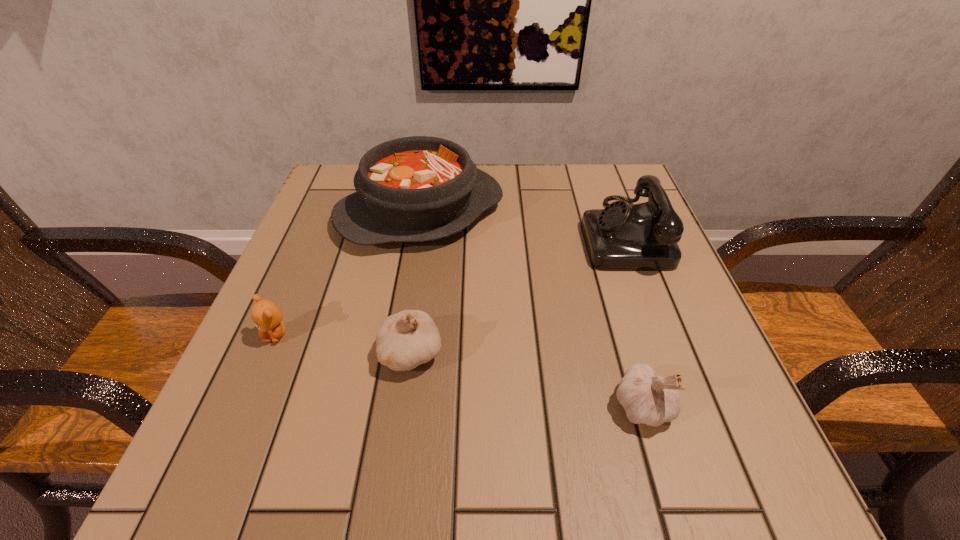
Image resolution: width=960 pixels, height=540 pixels. Find the location of `casserole`. casserole is located at coordinates (412, 189).

Where is `telephone`? The image size is (960, 540). telephone is located at coordinates (641, 237).

Locate an element on the screen. the right garlic is located at coordinates (648, 399).

This screenshot has height=540, width=960. What are the coordinates of `the left garlic` in the screenshot? It's located at (405, 340).

You are a GUI agent. You are given a task and a screenshot of the screen. Output one action in this format:
    pyautogui.click(x=<x>, y=<y>)
    Task: Click on the teddy bear
    
    Given the screenshot: What is the action you would take?
    pyautogui.click(x=266, y=315)

You are a GUI agent. You are given a task and a screenshot of the screen. Output one action in this format:
    pyautogui.click(x=<x>, y=<y>)
    Task: Click on the shortest object
    The width and height of the screenshot is (960, 540).
    Given the screenshot: What is the action you would take?
    pyautogui.click(x=266, y=315)

Locate an element on the screen. Image resolution: width=960 pixels, height=540 pixels. vacant space located on the back of the casserole is located at coordinates (428, 166).

The height and width of the screenshot is (540, 960). What are the coordinates of `vacant space situated on the dial of the telephone` in the screenshot? It's located at (527, 233).

Identify the location of vacant space located 0.100m on the dial of the telephone. This screenshot has height=540, width=960. (537, 233).

This screenshot has height=540, width=960. What are the coordinates of `vacant region located 0.280m on the dial of the telephone` in the screenshot? It's located at (453, 233).